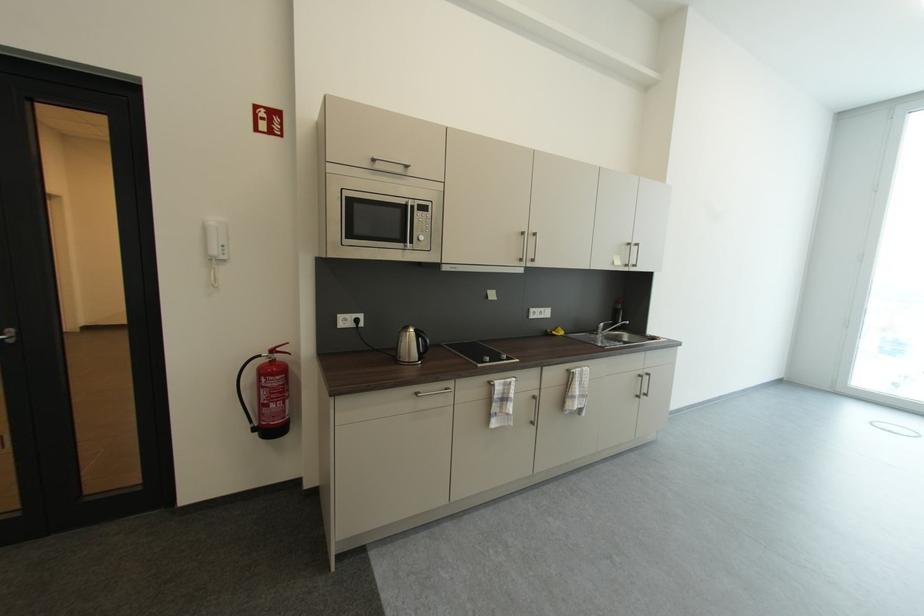
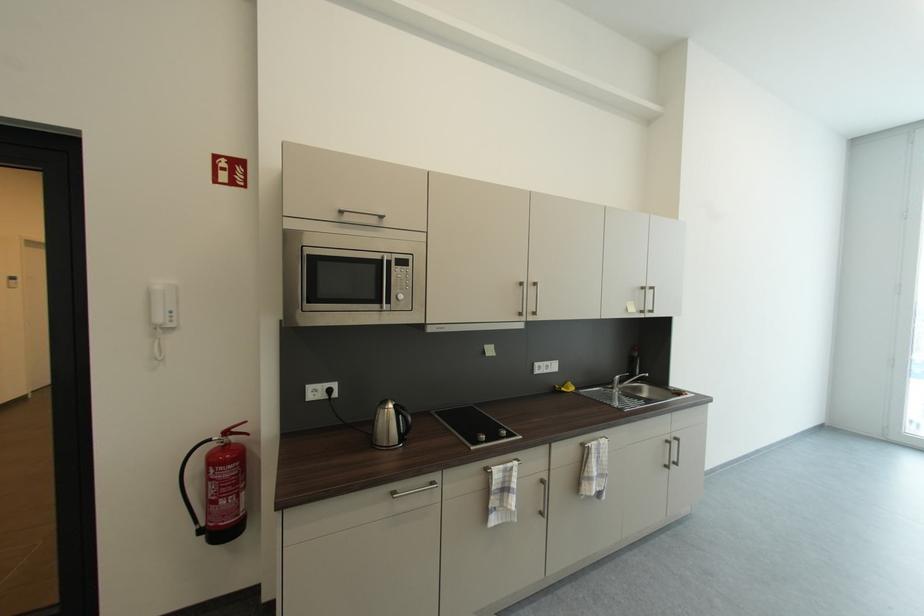
Find the pixel in the second image that matches point (254, 429) in the first image.

(199, 531)